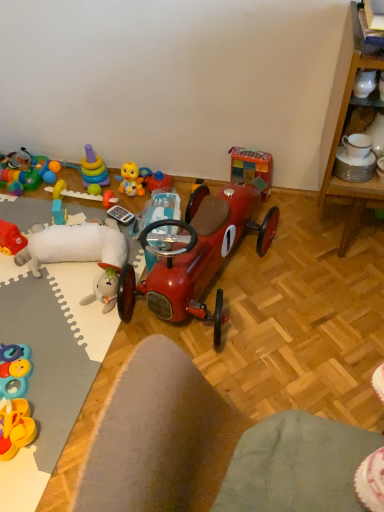
You are a GUI agent. You are given a task and a screenshot of the screen. Output one action in this format:
    pyautogui.click(x=<x>, y=<y>)
    Task: Click on the free space to the back side of rubber duck at left, which is counted as the second toy, starting from the left
    The width and height of the screenshot is (384, 512).
    Given the screenshot: What is the action you would take?
    (x=26, y=214)